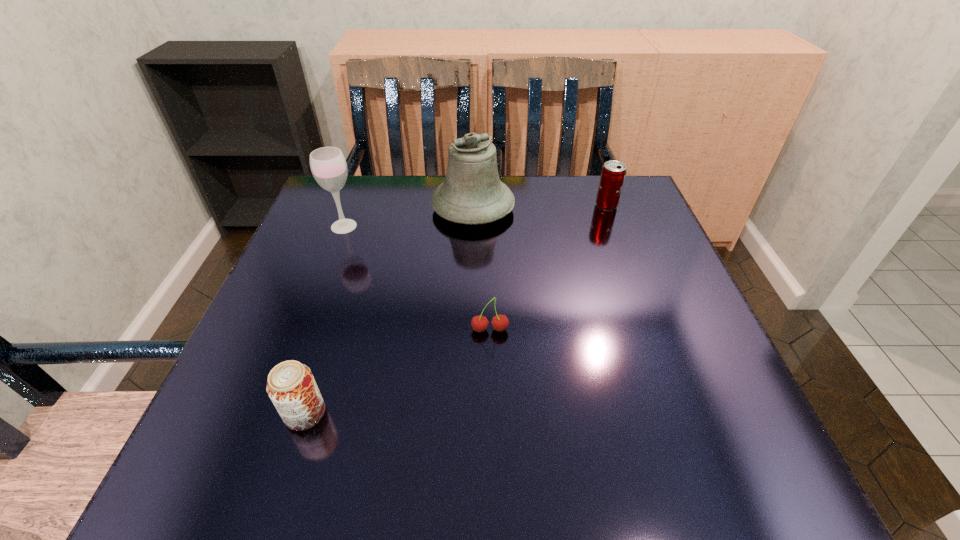
Image resolution: width=960 pixels, height=540 pixels. I want to click on vacant area that lies between the bell and the wineglass, so click(x=408, y=217).

Where is `free spot between the fourth farthest object and the wineglass`? This screenshot has width=960, height=540. free spot between the fourth farthest object and the wineglass is located at coordinates (417, 278).

At what (x,y) coordinates should I click in order to perform the action: click on vacant area between the farther beer can and the nearer beer can. Please return your answer as a coordinate pair (x, y). The height and width of the screenshot is (540, 960). Looking at the image, I should click on (456, 309).

The height and width of the screenshot is (540, 960). Find the location of `free space between the bell and the left beer can`. free space between the bell and the left beer can is located at coordinates (389, 310).

Locate an element on the screen. The height and width of the screenshot is (540, 960). empty location between the wineglass and the shortest object is located at coordinates (417, 278).

Locate an element on the screen. unoccupied position between the right beer can and the bell is located at coordinates (540, 207).

This screenshot has height=540, width=960. In order to click on free area in between the nearer beer can and the bell in this screenshot , I will do `click(389, 310)`.

I want to click on free space between the right beer can and the fourth farthest object, so click(548, 268).

Locate an element on the screen. The height and width of the screenshot is (540, 960). blank region between the cherry and the wineglass is located at coordinates (417, 278).

In order to click on object that is the second closest to the wineglass in this screenshot , I will do `click(479, 323)`.